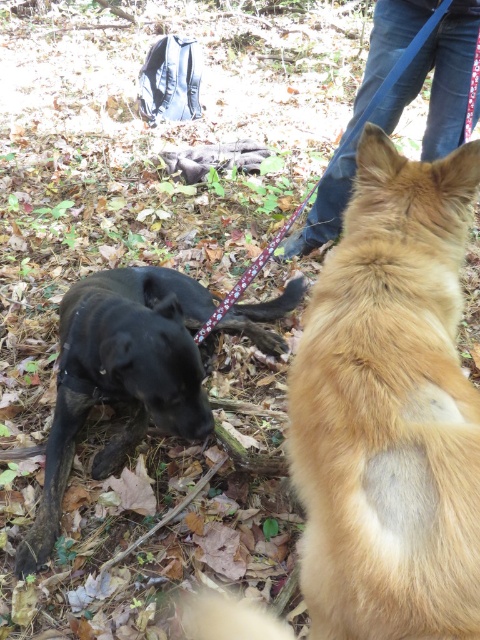
Question: Which of the following is the closest to the observer?

Choices:
 (A) (105, 314)
 (B) (375, 508)

Answer: (B)

Question: Observing the image, what is the correct spatial positioning of fuzzy golden dog at right in reference to shiny black dog at lower left?

Choices:
 (A) above
 (B) below

Answer: (A)

Question: Is fuzzy golden dog at right smaller than shiny black dog at lower left?

Choices:
 (A) yes
 (B) no

Answer: (A)

Question: Can you confirm if fuzzy golden dog at right is positioned to the right of shiny black dog at lower left?

Choices:
 (A) yes
 (B) no

Answer: (A)

Question: Which of the following is the farthest from the observer?

Choices:
 (A) (78, 413)
 (B) (477, 445)

Answer: (A)